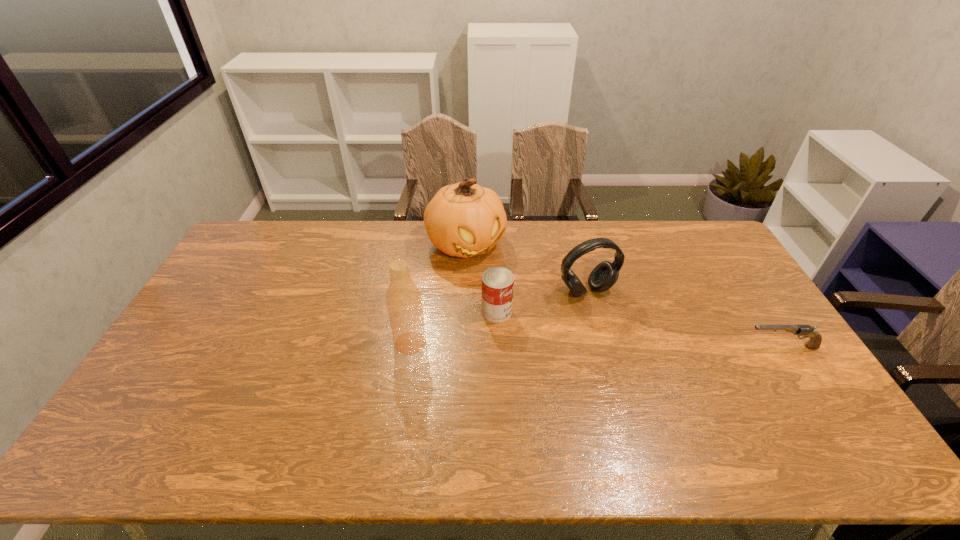
The width and height of the screenshot is (960, 540). What are the coordinates of `vacant space situated aiming along the barrel of the shortest object` in the screenshot? It's located at (710, 347).

At what (x,y) coordinates should I click in order to perform the action: click on vacant space situated on the earcups of the third shortest object. Please return your answer as a coordinate pair (x, y). The height and width of the screenshot is (540, 960). Looking at the image, I should click on (612, 323).

Where is `vacant position located 0.220m on the earcups of the third shortest object`? This screenshot has height=540, width=960. vacant position located 0.220m on the earcups of the third shortest object is located at coordinates (635, 356).

In order to click on vacant space located on the earcups of the third shortest object in this screenshot , I will do `click(662, 396)`.

The width and height of the screenshot is (960, 540). In order to click on vacant position located 0.090m on the front face of the farthest object in this screenshot , I will do `click(496, 282)`.

At what (x,y) coordinates should I click in order to perform the action: click on vacant space located 0.350m on the front face of the farthest object. Please return your answer as a coordinate pair (x, y). This screenshot has width=960, height=540. Looking at the image, I should click on (537, 335).

In order to click on vacant space located 0.270m on the front face of the farthest object in this screenshot , I will do `click(523, 318)`.

This screenshot has width=960, height=540. Find the location of `vacant space located 0.150m on the front label of the can`. vacant space located 0.150m on the front label of the can is located at coordinates (554, 337).

Locate an element on the screen. The width and height of the screenshot is (960, 540). free region located 0.310m on the front label of the can is located at coordinates (606, 360).

Find the location of a particular element. The height and width of the screenshot is (540, 960). blank space located on the front label of the can is located at coordinates (527, 325).